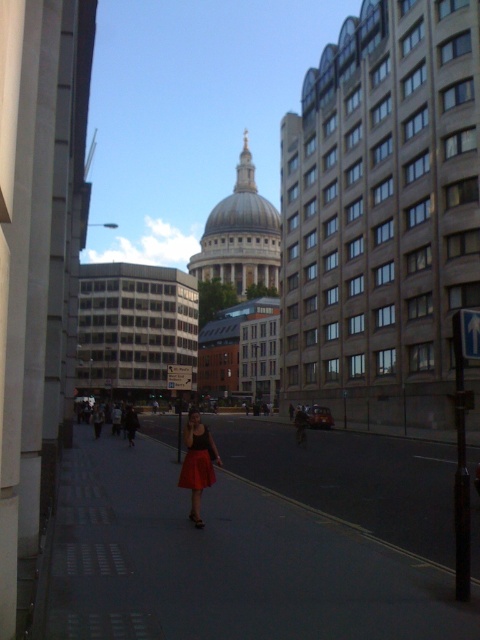
Is smooth concrete sidewalk at center above matte red skirt at center?

No, smooth concrete sidewalk at center is not above matte red skirt at center.

The height and width of the screenshot is (640, 480). Find the location of `smooth concrete sidewalk at center`. smooth concrete sidewalk at center is located at coordinates (225, 561).

Is matte red skirt at center shorter than matte red dress at center?

No, matte red skirt at center is not shorter than matte red dress at center.

Is the position of matte red skirt at center more distant than that of matte red dress at center?

Yes, it is.

Which is behind, point (192, 488) or point (203, 456)?

The point (203, 456) is more distant.

Find the location of `matte red skirt at center`. matte red skirt at center is located at coordinates (197, 464).

Can you confirm if smooth concrete sidewalk at center is shorter than matte red dress at center?

No.

The height and width of the screenshot is (640, 480). I want to click on smooth concrete sidewalk at center, so click(x=225, y=561).

You are a GUI agent. You are given a task and a screenshot of the screen. Output one action in this format:
    pyautogui.click(x=<x>, y=<y>)
    Task: Click on the smooth concrete sidewalk at center
    Image resolution: width=480 pixels, height=640 pixels.
    Given the screenshot: What is the action you would take?
    pyautogui.click(x=225, y=561)